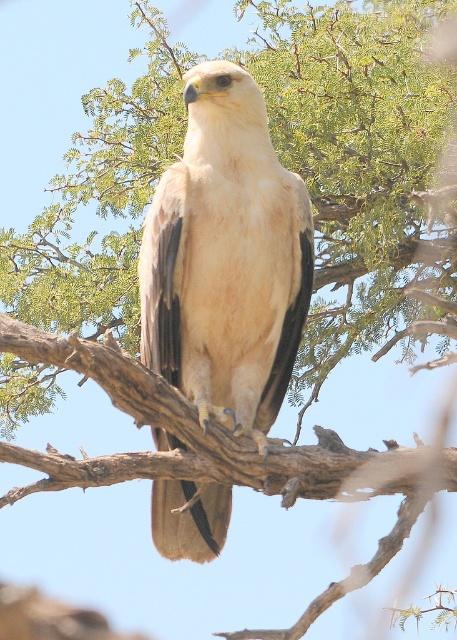
Question: Among these objects, which one is nearest to the camera?

Choices:
 (A) brown rough tree branch at center
 (B) light brown feathered eagle at center

Answer: (A)

Question: Can you confirm if light brown feathered eagle at center is positioned to the left of brown rough tree branch at center?

Choices:
 (A) yes
 (B) no

Answer: (B)

Question: Observing the image, what is the correct spatial positioning of light brown feathered eagle at center in reference to brown rough tree branch at center?

Choices:
 (A) above
 (B) below

Answer: (A)

Question: Does light brown feathered eagle at center have a greater width compared to brown rough tree branch at center?

Choices:
 (A) no
 (B) yes

Answer: (A)